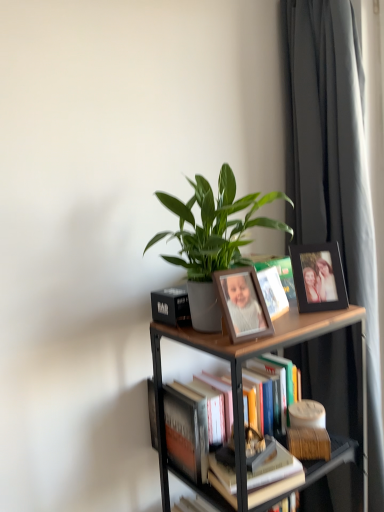
Question: Considering the positions of black matte picture frame at upper right, which is counted as the 2th picture frame, starting from the left, and wooden photo frame at center, which is the second picture frame from right to left, in the image, is black matte picture frame at upper right, which is counted as the 2th picture frame, starting from the left, taller or shorter than wooden photo frame at center, which is the second picture frame from right to left,?

Choices:
 (A) short
 (B) tall

Answer: (B)

Question: From the image's perspective, is black matte picture frame at upper right, positioned as the first picture frame in back-to-front order, above or below wooden photo frame at center, the 1th picture frame positioned from the front?

Choices:
 (A) above
 (B) below

Answer: (A)

Question: Estimate the real-world distances between objects in this image. Which object is farther from the woodenmaterial/textureshelf at upper center?

Choices:
 (A) matte white book at center
 (B) dark gray fabric curtain at right
 (C) black matte picture frame at upper right, positioned as the first picture frame in back-to-front order
 (D) hardcover books at center, which is counted as the first book, starting from the back
 (E) wooden photo frame at center, which appears as the 2th picture frame when viewed from the back

Answer: (B)

Question: Which object is positioned closest to the hardcover books at center, which is counted as the first book, starting from the back?

Choices:
 (A) green matte plant at center
 (B) matte white book at center
 (C) woodenmaterial/textureshelf at upper center
 (D) hardcover book at center, positioned as the 1th book in front-to-back order
 (E) wooden photo frame at center, which ranks as the first picture frame in left-to-right order

Answer: (D)